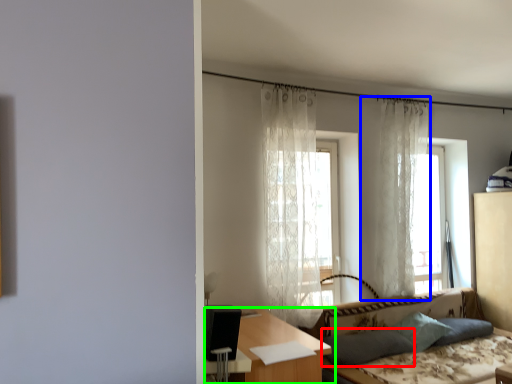
Question: Based on their relative distances, which object is nearer to pillow (highlighted by a red box)? Choose from curtain (highlighted by a blue box) and table (highlighted by a green box).

Choices:
 (A) curtain
 (B) table

Answer: (B)